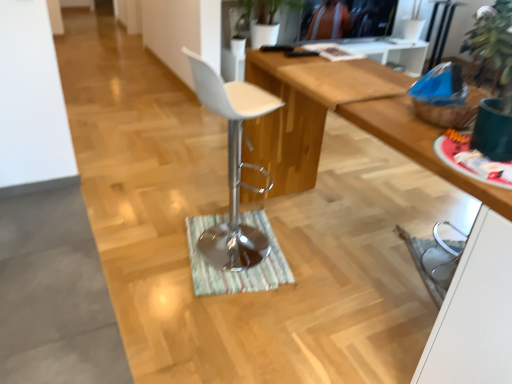
The width and height of the screenshot is (512, 384). What are the coordinates of `vacant space underneath wooden desk at center (from a real-world perspective)` in the screenshot? It's located at (342, 262).